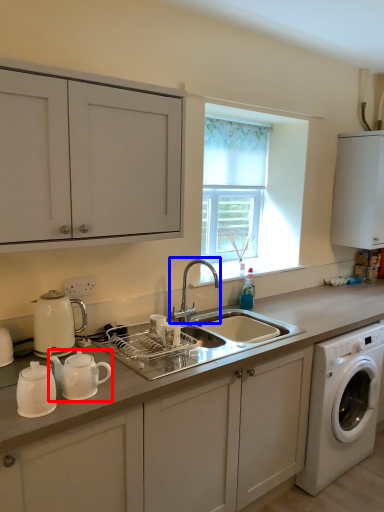
Question: Which object appears farthest to the camera in this image, tea pot (highlighted by a red box) or tap (highlighted by a blue box)?

Choices:
 (A) tea pot
 (B) tap

Answer: (B)